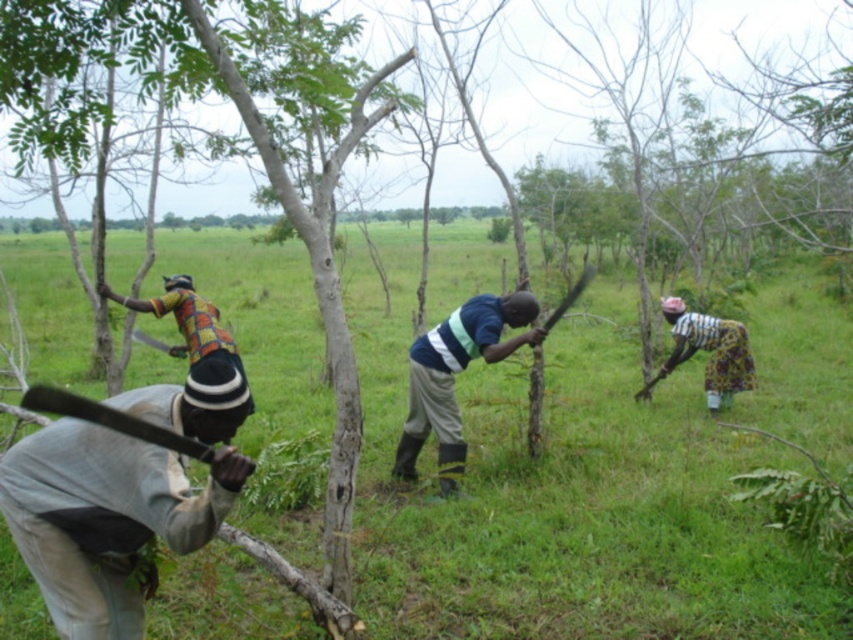
Question: Which of the following is the closest to the observer?

Choices:
 (A) blue striped shirt at center
 (B) black matte ax at lower left
 (C) gray matte baseball bat at lower left

Answer: (B)

Question: Is gray matte baseball bat at lower left in front of black matte ax at lower left?

Choices:
 (A) yes
 (B) no

Answer: (B)

Question: Is gray matte baseball bat at lower left thinner than blue striped shirt at center?

Choices:
 (A) no
 (B) yes

Answer: (B)

Question: Which of the following is the closest to the observer?

Choices:
 (A) (192, 298)
 (B) (421, 588)

Answer: (B)

Question: Where is brown wooden stick at center located in relation to multicolored fabric shirt at left in the image?

Choices:
 (A) left
 (B) right

Answer: (B)

Question: Which point is farther to the camera?

Choices:
 (A) (498, 317)
 (B) (206, 330)
 (C) (239, 476)

Answer: (B)